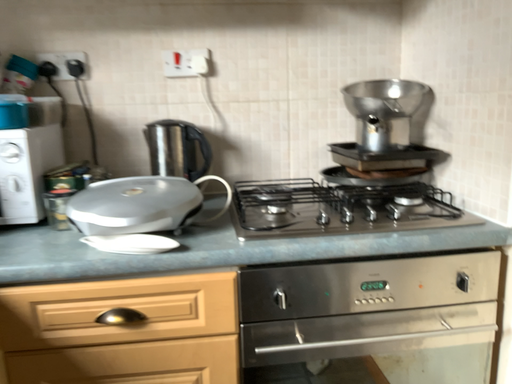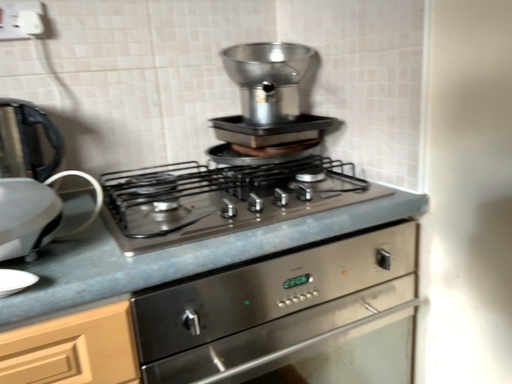
Question: How did the camera likely rotate when shooting the video?

Choices:
 (A) rotated right
 (B) rotated left

Answer: (A)